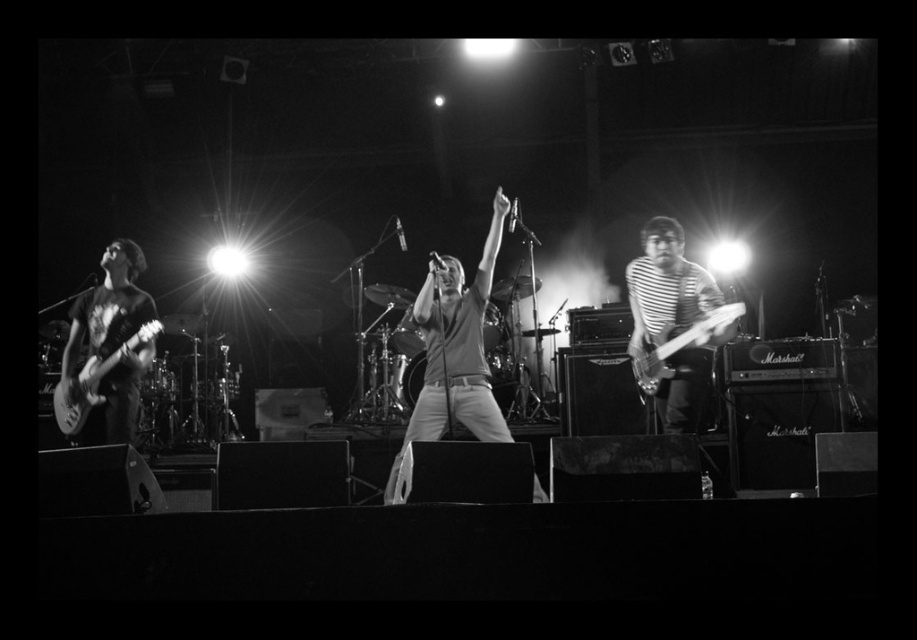
Is matte gray shirt at center smaller than metallic electric guitar at left?

Actually, matte gray shirt at center might be larger than metallic electric guitar at left.

Does matte gray shirt at center appear under metallic electric guitar at left?

Incorrect, matte gray shirt at center is not positioned below metallic electric guitar at left.

Locate an element on the screen. This screenshot has height=640, width=917. matte gray shirt at center is located at coordinates (455, 349).

Does matte gray shirt at center appear over striped fabric guitar at right?

No.

Who is shorter, matte gray shirt at center or striped fabric guitar at right?

With less height is striped fabric guitar at right.

Which is in front, point (484, 294) or point (643, 333)?

Positioned in front is point (484, 294).

Where is `matte gray shirt at center`? matte gray shirt at center is located at coordinates click(455, 349).

Who is taller, metallic silver guitar at right or metallic electric guitar at left?

With more height is metallic electric guitar at left.

Is metallic silver guitar at right smaller than metallic electric guitar at left?

Actually, metallic silver guitar at right might be larger than metallic electric guitar at left.

This screenshot has height=640, width=917. I want to click on metallic silver guitar at right, so click(x=678, y=346).